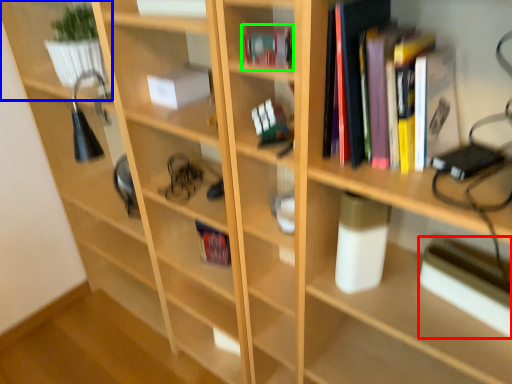
Question: Based on their relative distances, which object is farther from paperback book (highlighted by a red box)? Choose from shelf (highlighted by a blue box) and book (highlighted by a green box).

Choices:
 (A) shelf
 (B) book

Answer: (A)